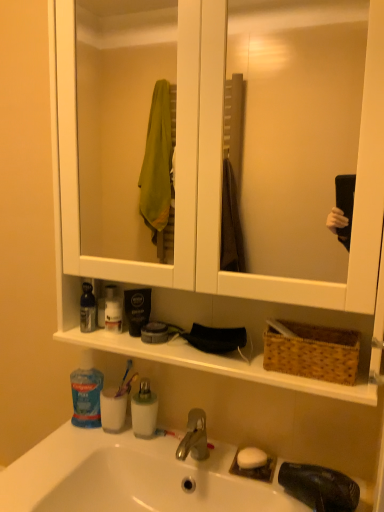
You are a GUI agent. You are given a task and a screenshot of the screen. Output one action in this format:
    pyautogui.click(x=<x>, y=<y>)
    Task: Click on the free space in front of white opaque bottle at center, which is the first mouthwash in right-to-left order
    This screenshot has width=384, height=512.
    Given the screenshot: What is the action you would take?
    pyautogui.click(x=139, y=455)